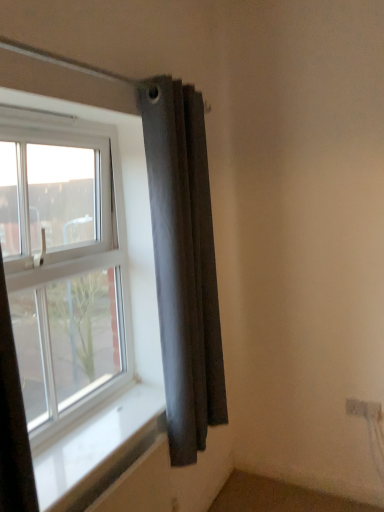
You are a GUI agent. You are given a task and a screenshot of the screen. Output one action in this format:
    pyautogui.click(x=<x>, y=<y>)
    Task: Click on the vacant region above white smooth window sill at lower left (from a real-world perspective)
    The height and width of the screenshot is (512, 384).
    Given the screenshot: What is the action you would take?
    pyautogui.click(x=94, y=425)